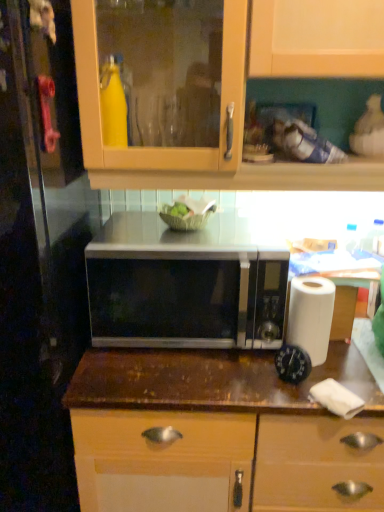
What is the approximate width of white paper towel at lower right?

It is 5.47 inches.

What do you see at coordinates (218, 432) in the screenshot?
I see `brown wood countertop at center` at bounding box center [218, 432].

The image size is (384, 512). What do you see at coordinates (311, 316) in the screenshot? I see `white paper at right` at bounding box center [311, 316].

What is the approximate height of satin silver microwave at center?

11.73 inches.

This screenshot has width=384, height=512. I want to click on transparent glass door at left, so click(x=39, y=260).

Is satin silver microwave at center taller or shorter than white paper towel at lower right?

Clearly, satin silver microwave at center is taller compared to white paper towel at lower right.

Which point is more forward, (179, 345) or (324, 382)?

Positioned in front is point (324, 382).

Locate an element on the screen. toilet paper in front of the satin silver microwave at center is located at coordinates (336, 398).

Is white paper towel at lower right completely or partially inside satin silver microwave at center?

Actually, white paper towel at lower right is outside satin silver microwave at center.

Is white paper at right positioned far away from transparent glass door at left?

No, white paper at right is not far from transparent glass door at left.

In terms of width, does white paper at right look wider or thinner when compared to transparent glass door at left?

Clearly, white paper at right has less width compared to transparent glass door at left.

From the image's perspective, between white paper at right and transparent glass door at left, which one is located above?

white paper at right is shown above in the image.

Which object is positioned more to the left, white paper at right or transparent glass door at left?

transparent glass door at left is more to the left.

Locate an element on the screen. paper towel on the right of satin silver microwave at center is located at coordinates (311, 316).

Which of these two, white paper at right or satin silver microwave at center, is smaller?

With smaller size is white paper at right.

From a real-world perspective, which object stands above the other?

satin silver microwave at center is physically above.

Is white paper at right to the right of satin silver microwave at center from the viewer's perspective?

Indeed, white paper at right is positioned on the right side of satin silver microwave at center.

Is there a large distance between transparent glass door at left and brown wood countertop at center?

Actually, transparent glass door at left and brown wood countertop at center are a little close together.

Identify the location of glass door located on the left of brown wood countertop at center. The height and width of the screenshot is (512, 384). [x=39, y=260].

From a real-world perspective, does transparent glass door at left stand above brown wood countertop at center?

Yes, from a real-world perspective, transparent glass door at left is over brown wood countertop at center

Is satin silver microwave at center at the back of transparent glass door at left?

No, satin silver microwave at center is not at the back of transparent glass door at left.

Are transparent glass door at left and satin silver microwave at center far apart?

transparent glass door at left is actually quite close to satin silver microwave at center.

Looking at this image, considering the relative sizes of transparent glass door at left and satin silver microwave at center in the image provided, is transparent glass door at left wider than satin silver microwave at center?

Indeed, transparent glass door at left has a greater width compared to satin silver microwave at center.

Does transparent glass door at left have a lesser width compared to white paper at right?

No, transparent glass door at left is not thinner than white paper at right.

Where is `glass door located underneath the white paper at right (from a real-world perspective)`? The image size is (384, 512). glass door located underneath the white paper at right (from a real-world perspective) is located at coordinates tap(39, 260).

In the scene shown: Which object is closer to the camera taking this photo, transparent glass door at left or white paper at right?

transparent glass door at left is closer to the camera.

How much distance is there between white paper at right and white paper towel at lower right?

A distance of 6.49 inches exists between white paper at right and white paper towel at lower right.

Is white paper at right wider than white paper towel at lower right?

Incorrect, the width of white paper at right does not surpass that of white paper towel at lower right.

Is white paper at right facing away from white paper towel at lower right?

No, white paper towel at lower right is not at the back of white paper at right.

Identify the location of paper towel that appears behind the white paper towel at lower right. click(x=311, y=316).

You are a GUI agent. You are given a task and a screenshot of the screen. Output one action in this format:
    pyautogui.click(x=<x>, y=<y>)
    Task: Click on the toilet paper below the satin silver microwave at center (from the image's perspective)
    
    Given the screenshot: What is the action you would take?
    pyautogui.click(x=336, y=398)

The height and width of the screenshot is (512, 384). What are the coordinates of `paper towel behind the transparent glass door at left` in the screenshot? It's located at (311, 316).

Based on their spatial positions, is satin silver microwave at center or white paper towel at lower right further from transparent glass door at left?

white paper towel at lower right is positioned further to the anchor transparent glass door at left.

Based on their spatial positions, is brown wood countertop at center or transparent glass door at left further from white paper towel at lower right?

Among the two, transparent glass door at left is located further to white paper towel at lower right.

Estimate the real-world distances between objects in this image. Which object is closer to white paper towel at lower right, brown wood countertop at center or white paper at right?

white paper at right.

In the scene shown: Based on their spatial positions, is white paper at right or white paper towel at lower right closer to transparent glass door at left?

Based on the image, white paper at right appears to be nearer to transparent glass door at left.

Based on the photo, looking at the image, which one is located closer to satin silver microwave at center, brown wood countertop at center or white paper at right?

brown wood countertop at center is closer to satin silver microwave at center.

Looking at the image, which one is located closer to satin silver microwave at center, transparent glass door at left or white paper at right?

Among the two, white paper at right is located nearer to satin silver microwave at center.

Based on their spatial positions, is brown wood countertop at center or white paper at right further from transparent glass door at left?

white paper at right.

Considering their positions, is white paper at right positioned closer to satin silver microwave at center than white paper towel at lower right?

Based on the image, white paper at right appears to be nearer to satin silver microwave at center.

Identify the location of microwave oven located between transparent glass door at left and white paper at right in the left-right direction. (184, 285).

At what (x,y) coordinates should I click in order to perform the action: click on paper towel between satin silver microwave at center and white paper towel at lower right. Please return your answer as a coordinate pair (x, y). The width and height of the screenshot is (384, 512). Looking at the image, I should click on (311, 316).

Image resolution: width=384 pixels, height=512 pixels. Find the location of `countertop between transparent glass door at left and white paper at right from left to right`. countertop between transparent glass door at left and white paper at right from left to right is located at coordinates (218, 432).

Where is `paper towel between transparent glass door at left and white paper towel at lower right in the horizontal direction`? The height and width of the screenshot is (512, 384). paper towel between transparent glass door at left and white paper towel at lower right in the horizontal direction is located at coordinates (311, 316).